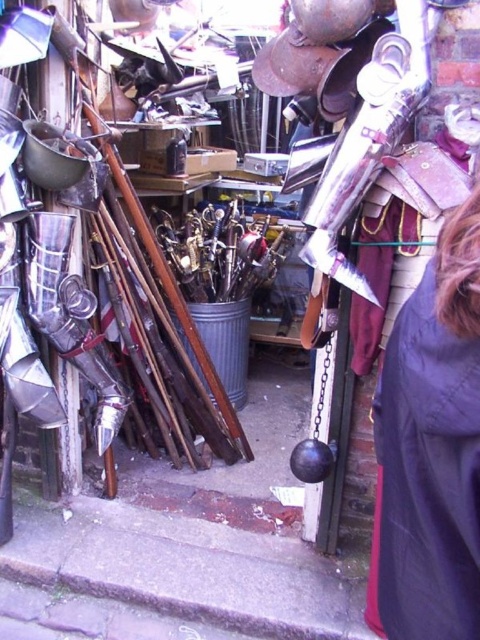
You are a customer in the shop and want to pick up the metallic sheen sword at center. However, the dark gray fabric cape at lower right is blocking your path. Can you move the cape to access the sword?

The dark gray fabric cape at lower right is in front of the metallic sheen sword at center, so you can move the cape to access the sword.

You are a customer in this medieval shop and want to pick up the dark gray fabric cape at lower right and the metallic sheen sword at center. Based on their positions, which item is closer to the entrance of the shop?

The dark gray fabric cape at lower right is to the right of the metallic sheen sword at center, so the metallic sheen sword at center is closer to the entrance than the dark gray fabric cape at lower right.